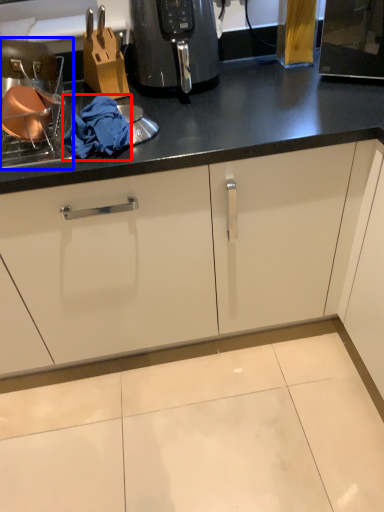
Question: Which of the following is the farthest to the observer, material (highlighted by a red box) or appliance (highlighted by a blue box)?

Choices:
 (A) material
 (B) appliance

Answer: (A)